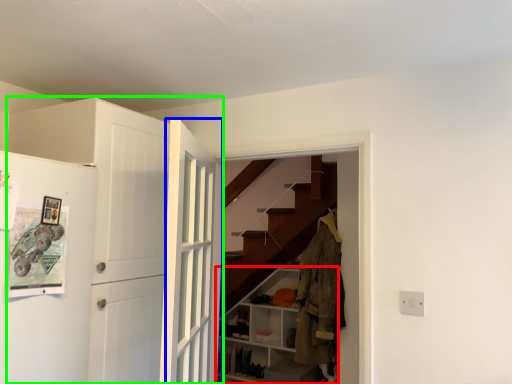
Question: Based on their relative distances, which object is farther from cabinetry (highlighted by a red box)? Choose from door (highlighted by a blue box) and door (highlighted by a green box).

Choices:
 (A) door
 (B) door

Answer: (B)